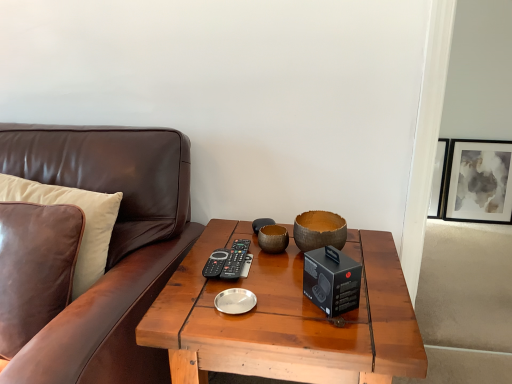
Question: From their relative heights in the image, would you say leather pillow at left is taller or shorter than brown leather couch at left?

Choices:
 (A) short
 (B) tall

Answer: (A)

Question: From the image's perspective, is leather pillow at left positioned above or below brown leather couch at left?

Choices:
 (A) below
 (B) above

Answer: (B)

Question: Which is nearer to the wooden coffee table at center?

Choices:
 (A) matte black picture frame at upper right
 (B) leather pillow at left
 (C) natural wood bowl at center
 (D) brown leather couch at left

Answer: (C)

Question: Estimate the real-world distances between objects in this image. Which object is farther from the wooden coffee table at center?

Choices:
 (A) leather pillow at left
 (B) matte black picture frame at upper right
 (C) natural wood bowl at center
 (D) brown leather couch at left

Answer: (B)